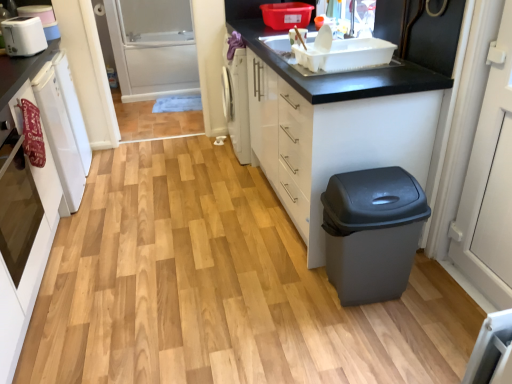
Locate an element on the screen. Image resolution: width=512 pixels, height=384 pixels. matte gray plastic trash can at lower right is located at coordinates (372, 232).

The image size is (512, 384). What do you see at coordinates (17, 205) in the screenshot?
I see `white glossy oven at left` at bounding box center [17, 205].

What do you see at coordinates (335, 126) in the screenshot?
I see `white glossy cabinet at lower right, the 2th cabinetry when ordered from left to right` at bounding box center [335, 126].

Locate an element on the screen. white matte dishwasher at left is located at coordinates (60, 134).

Identify the location of matte gray plastic trash can at lower right. (372, 232).

Would you say white matte dishwasher at left contains white glossy cabinet at lower right, the first cabinetry when ordered from right to left?

That's incorrect, white glossy cabinet at lower right, the first cabinetry when ordered from right to left, is not inside white matte dishwasher at left.

Who is taller, white matte dishwasher at left or white glossy cabinet at lower right, the 2th cabinetry when ordered from left to right?

white glossy cabinet at lower right, the 2th cabinetry when ordered from left to right, is taller.

Does point (72, 178) come closer to viewer compared to point (362, 136)?

No, it is not.

The image size is (512, 384). In order to click on cabinetry lying in front of the matte gray plastic trash can at lower right in this screenshot , I will do `click(26, 259)`.

Is white glossy oven at left, which is counted as the 2th cabinetry, starting from the right, inside or outside of matte gray plastic trash can at lower right?

white glossy oven at left, which is counted as the 2th cabinetry, starting from the right, is not inside matte gray plastic trash can at lower right, it's outside.

Considering the positions of objects white glossy oven at left, which is counted as the 2th cabinetry, starting from the right, and matte gray plastic trash can at lower right in the image provided, who is in front, white glossy oven at left, which is counted as the 2th cabinetry, starting from the right, or matte gray plastic trash can at lower right?

Positioned in front is white glossy oven at left, which is counted as the 2th cabinetry, starting from the right.

Based on the photo, would you say white matte dishwasher at left is part of matte gray plastic trash can at lower right's contents?

Definitely not — white matte dishwasher at left is not inside matte gray plastic trash can at lower right.

Based on their positions, is matte gray plastic trash can at lower right located to the left or right of white matte dishwasher at left?

Based on their positions, matte gray plastic trash can at lower right is located to the right of white matte dishwasher at left.

Based on the photo, from the image's perspective, does matte gray plastic trash can at lower right appear higher than white matte dishwasher at left?

No.

Is matte gray plastic trash can at lower right taller or shorter than white matte dishwasher at left?

matte gray plastic trash can at lower right is shorter than white matte dishwasher at left.

How distant is white matte dishwasher at left from white glossy oven at left?

They are 17.71 inches apart.

Is white matte dishwasher at left facing towards white glossy oven at left?

No.

Which object is further away from the camera taking this photo, white matte dishwasher at left or white glossy oven at left?

white matte dishwasher at left is further from the camera.

Which of these two, white matte dishwasher at left or white glossy oven at left, is wider?

white matte dishwasher at left is wider.

Considering the sizes of objects white plastic sink at upper center and white plastic toaster at upper left in the image provided, who is shorter, white plastic sink at upper center or white plastic toaster at upper left?

With less height is white plastic sink at upper center.

Where is `sink located in front of the white plastic toaster at upper left`? sink located in front of the white plastic toaster at upper left is located at coordinates (332, 52).

Could white plastic toaster at upper left be considered to be inside white plastic sink at upper center?

Definitely not — white plastic toaster at upper left is not inside white plastic sink at upper center.

Considering the sizes of objects white plastic sink at upper center and white plastic toaster at upper left in the image provided, who is thinner, white plastic sink at upper center or white plastic toaster at upper left?

white plastic toaster at upper left.

In the scene shown: Which of these two, white glossy oven at left, acting as the first cabinetry starting from the left, or white plastic sink at upper center, is wider?

With larger width is white glossy oven at left, acting as the first cabinetry starting from the left.

This screenshot has height=384, width=512. What are the coordinates of `the 2nd cabinetry counting from the left of the white plastic sink at upper center` in the screenshot? It's located at (26, 259).

From a real-world perspective, relative to white plastic sink at upper center, is white glossy oven at left, which is counted as the 2th cabinetry, starting from the right, vertically above or below?

white glossy oven at left, which is counted as the 2th cabinetry, starting from the right, is situated lower than white plastic sink at upper center in the real world.

Does white glossy oven at left, acting as the first cabinetry starting from the left, come behind white plastic sink at upper center?

That is False.

Considering the sizes of objects white plastic sink at upper center and white glossy oven at left in the image provided, who is taller, white plastic sink at upper center or white glossy oven at left?

With more height is white glossy oven at left.

From the image's perspective, which is above, white plastic sink at upper center or white glossy oven at left?

white plastic sink at upper center, from the image's perspective.

Consider the image. Between white plastic sink at upper center and white glossy oven at left, which one appears on the right side from the viewer's perspective?

white plastic sink at upper center.

Looking at this image, can white glossy oven at left be found inside white plastic sink at upper center?

That's incorrect, white glossy oven at left is not inside white plastic sink at upper center.

Where is `dish washer located above the white glossy cabinet at lower right, the first cabinetry when ordered from right to left (from a real-world perspective)`? The width and height of the screenshot is (512, 384). dish washer located above the white glossy cabinet at lower right, the first cabinetry when ordered from right to left (from a real-world perspective) is located at coordinates (60, 134).

Find the location of a particular element. The image size is (512, 384). cabinetry in front of the matte gray plastic trash can at lower right is located at coordinates (26, 259).

When comparing their distances from white glossy cabinet at lower right, the first cabinetry when ordered from right to left, does matte gray plastic trash can at lower right or white glossy oven at left, acting as the first cabinetry starting from the left, seem closer?

Among the two, matte gray plastic trash can at lower right is located nearer to white glossy cabinet at lower right, the first cabinetry when ordered from right to left.

When comparing their distances from matte gray plastic trash can at lower right, does white plastic sink at upper center or white glossy oven at left, acting as the first cabinetry starting from the left, seem closer?

white plastic sink at upper center lies closer to matte gray plastic trash can at lower right than the other object.

Looking at the image, which one is located further to white matte dishwasher at left, white glossy oven at left or white plastic toaster at upper left?

white glossy oven at left.

From the image, which object appears to be farther from white glossy oven at left, white plastic sink at upper center or white glossy oven at left, which is counted as the 2th cabinetry, starting from the right?

The object further to white glossy oven at left is white plastic sink at upper center.

From the image, which object appears to be farther from white glossy cabinet at lower right, the first cabinetry when ordered from right to left, white glossy oven at left or white glossy oven at left, which is counted as the 2th cabinetry, starting from the right?

The object further to white glossy cabinet at lower right, the first cabinetry when ordered from right to left, is white glossy oven at left.

Estimate the real-world distances between objects in this image. Which object is closer to white plastic toaster at upper left, white glossy cabinet at lower right, the first cabinetry when ordered from right to left, or matte gray plastic trash can at lower right?

white glossy cabinet at lower right, the first cabinetry when ordered from right to left, lies closer to white plastic toaster at upper left than the other object.

Estimate the real-world distances between objects in this image. Which object is further from white plastic toaster at upper left, white matte dishwasher at left or white glossy oven at left?

white glossy oven at left is positioned further to the anchor white plastic toaster at upper left.

When comparing their distances from matte gray plastic trash can at lower right, does white plastic sink at upper center or white glossy cabinet at lower right, the 2th cabinetry when ordered from left to right, seem closer?

Based on the image, white glossy cabinet at lower right, the 2th cabinetry when ordered from left to right, appears to be nearer to matte gray plastic trash can at lower right.

I want to click on dish washer situated between white plastic toaster at upper left and white glossy cabinet at lower right, the first cabinetry when ordered from right to left, from left to right, so click(x=60, y=134).

Image resolution: width=512 pixels, height=384 pixels. I want to click on cabinetry situated between white plastic toaster at upper left and white glossy cabinet at lower right, the 2th cabinetry when ordered from left to right, from left to right, so click(26, 259).

I want to click on cabinetry between white glossy oven at left and matte gray plastic trash can at lower right, so click(x=335, y=126).

At what (x,y) coordinates should I click in order to perform the action: click on sink between white matte dishwasher at left and matte gray plastic trash can at lower right. Please return your answer as a coordinate pair (x, y). This screenshot has width=512, height=384. Looking at the image, I should click on (332, 52).